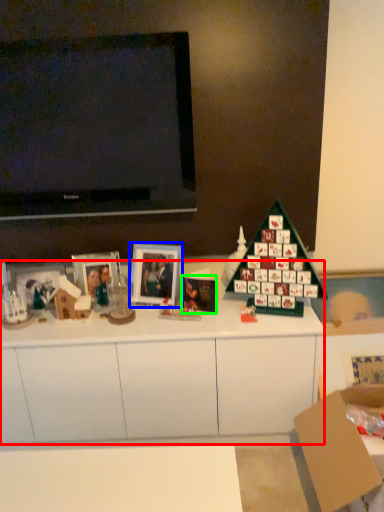
Question: Which is farther away from cabinetry (highlighted by a red box)? picture frame (highlighted by a blue box) or christmas card (highlighted by a green box)?

Choices:
 (A) picture frame
 (B) christmas card

Answer: (B)